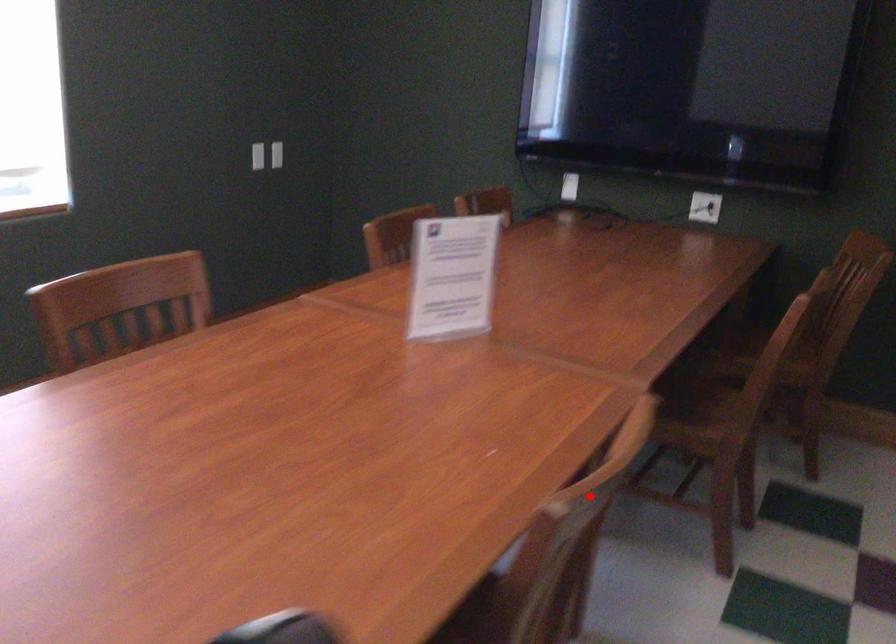
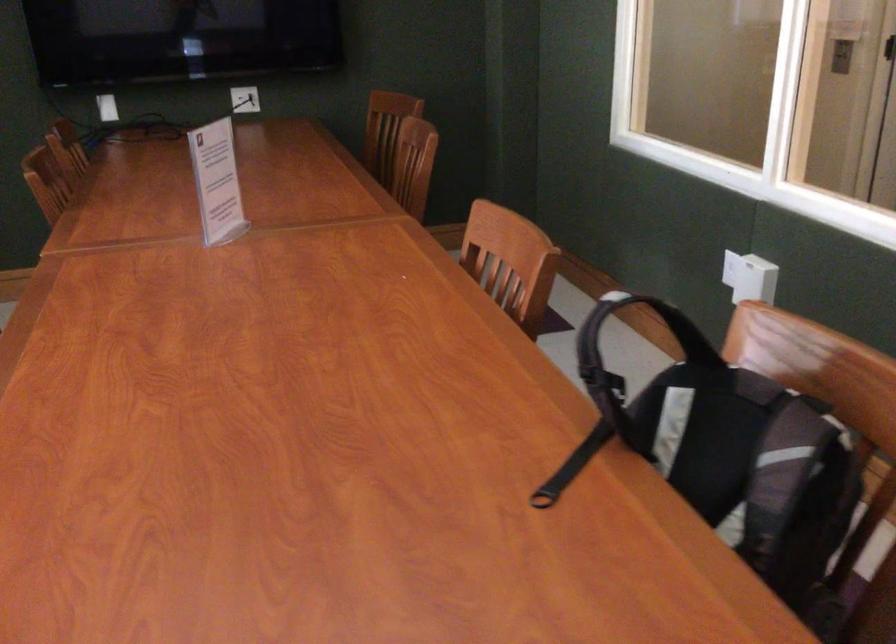
In the second image, find the point that corresponds to the highlighted location in the first image.

(510, 261)